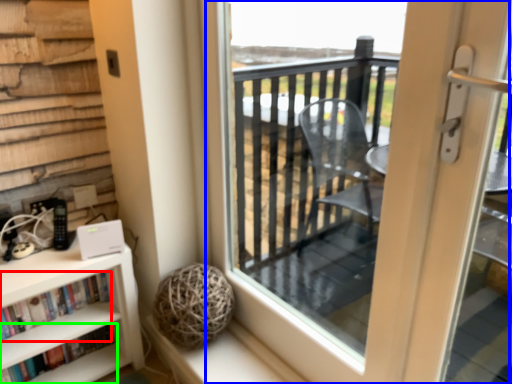
Question: Which object is positioned farthest from book (highlighted by a red box)? Select from screen door (highlighted by a blue box) and book (highlighted by a green box).

Choices:
 (A) screen door
 (B) book

Answer: (A)